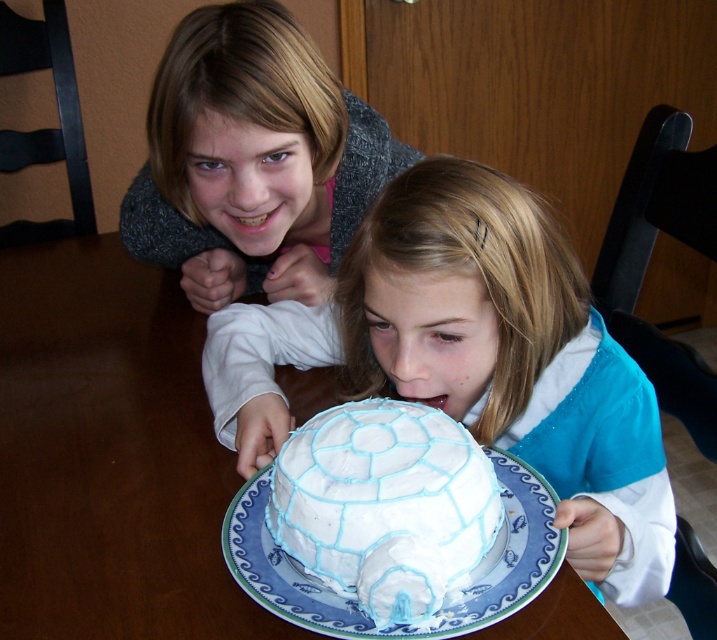
Is matte gray sweater at upper left further to the viewer compared to white frosting igloo at center?

Yes, matte gray sweater at upper left is further from the viewer.

Can you confirm if matte gray sweater at upper left is smaller than white frosting igloo at center?

Incorrect, matte gray sweater at upper left is not smaller in size than white frosting igloo at center.

Is point (227, 26) behind point (338, 577)?

Yes.

At what (x,y) coordinates should I click in order to perform the action: click on matte gray sweater at upper left. Please return your answer as a coordinate pair (x, y). The image size is (717, 640). Looking at the image, I should click on point(252,160).

Does white glossy cake at center have a greater width compared to matte gray sweater at upper left?

Indeed, white glossy cake at center has a greater width compared to matte gray sweater at upper left.

The width and height of the screenshot is (717, 640). I want to click on white glossy cake at center, so click(x=473, y=358).

At what (x,y) coordinates should I click in order to perform the action: click on white glossy cake at center. Please return your answer as a coordinate pair (x, y). This screenshot has height=640, width=717. Looking at the image, I should click on (473, 358).

Can you confirm if white glossy cake at center is bigger than white frosting igloo at center?

Correct, white glossy cake at center is larger in size than white frosting igloo at center.

Which is above, white glossy cake at center or white frosting igloo at center?

white glossy cake at center is higher up.

Who is more forward, [356,360] or [308,528]?

Point [308,528] is more forward.

Where is `white glossy cake at center`? The width and height of the screenshot is (717, 640). white glossy cake at center is located at coordinates (473, 358).